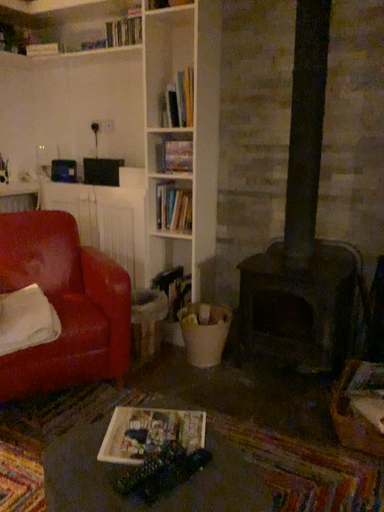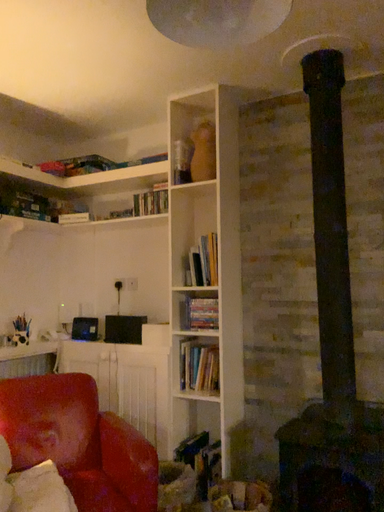
Question: How did the camera likely rotate when shooting the video?

Choices:
 (A) rotated upward
 (B) rotated downward

Answer: (A)